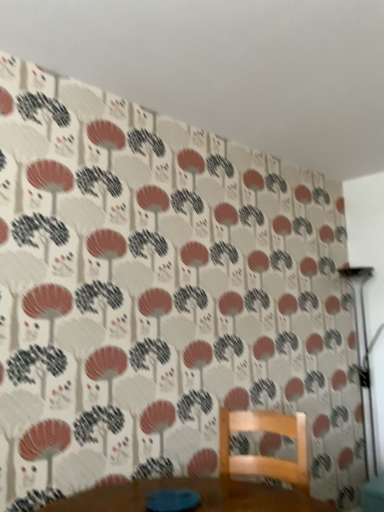
Find the location of a particular element. wooden chair at center is located at coordinates (261, 455).

The image size is (384, 512). Describe the element at coordinates (261, 455) in the screenshot. I see `wooden chair at center` at that location.

What is the approximate width of metallic silver table lamp at right?

metallic silver table lamp at right is 8.56 inches in width.

The image size is (384, 512). What do you see at coordinates (363, 358) in the screenshot?
I see `metallic silver table lamp at right` at bounding box center [363, 358].

Where is `metallic silver table lamp at right`? metallic silver table lamp at right is located at coordinates (363, 358).

This screenshot has width=384, height=512. I want to click on wooden chair at center, so click(x=261, y=455).

Which object is positioned more to the left, wooden chair at center or metallic silver table lamp at right?

wooden chair at center.

In the scene shown: Is wooden chair at center closer to camera compared to metallic silver table lamp at right?

Yes.

Considering the points (299, 471) and (372, 458), which point is in front, point (299, 471) or point (372, 458)?

Point (299, 471)

From the image's perspective, which one is positioned higher, wooden chair at center or metallic silver table lamp at right?

metallic silver table lamp at right, from the image's perspective.

Looking at this image, from a real-world perspective, relative to metallic silver table lamp at right, is wooden chair at center vertically above or below?

wooden chair at center is situated lower than metallic silver table lamp at right in the real world.

Between wooden chair at center and metallic silver table lamp at right, which one has larger width?

wooden chair at center.

Which of these two, wooden chair at center or metallic silver table lamp at right, stands taller?

With more height is metallic silver table lamp at right.

Considering the sizes of objects wooden chair at center and metallic silver table lamp at right in the image provided, who is bigger, wooden chair at center or metallic silver table lamp at right?

metallic silver table lamp at right is bigger.

Is wooden chair at center situated inside metallic silver table lamp at right or outside?

wooden chair at center is located beyond the bounds of metallic silver table lamp at right.

Would you consider wooden chair at center to be distant from metallic silver table lamp at right?

Indeed, wooden chair at center is not near metallic silver table lamp at right.

Looking at this image, is wooden chair at center oriented away from metallic silver table lamp at right?

Yes, wooden chair at center is positioned with its back facing metallic silver table lamp at right.

How many degrees apart are the facing directions of wooden chair at center and metallic silver table lamp at right?

27.5 degrees.

Identify the location of furniture lying in front of the metallic silver table lamp at right. (261, 455).

Which object is positioned more to the right, metallic silver table lamp at right or wooden chair at center?

From the viewer's perspective, metallic silver table lamp at right appears more on the right side.

Which is in front, metallic silver table lamp at right or wooden chair at center?

wooden chair at center is in front.

Does point (376, 461) come farther from viewer compared to point (300, 428)?

That is True.

From the image's perspective, is metallic silver table lamp at right located beneath wooden chair at center?

No, from the image's perspective, metallic silver table lamp at right is not below wooden chair at center.

From a real-world perspective, is metallic silver table lamp at right on wooden chair at center?

Yes, from a real-world perspective, metallic silver table lamp at right is over wooden chair at center

Is metallic silver table lamp at right wider than wooden chair at center?

Incorrect, the width of metallic silver table lamp at right does not surpass that of wooden chair at center.

Considering the relative sizes of metallic silver table lamp at right and wooden chair at center in the image provided, is metallic silver table lamp at right taller than wooden chair at center?

Yes.

Which of these two, metallic silver table lamp at right or wooden chair at center, is smaller?

wooden chair at center is smaller.

Is metallic silver table lamp at right outside of wooden chair at center?

metallic silver table lamp at right is positioned outside wooden chair at center.

Is metallic silver table lamp at right positioned far away from wooden chair at center?

Yes, metallic silver table lamp at right and wooden chair at center are located far from each other.

Is metallic silver table lamp at right aimed at wooden chair at center?

Yes, metallic silver table lamp at right faces towards wooden chair at center.

Find the location of `table lamp above the wooden chair at center (from a real-world perspective)`. table lamp above the wooden chair at center (from a real-world perspective) is located at coordinates (363, 358).

Where is `table lamp behind the wooden chair at center`? table lamp behind the wooden chair at center is located at coordinates (363, 358).

Where is `furniture in front of the metallic silver table lamp at right`? furniture in front of the metallic silver table lamp at right is located at coordinates (261, 455).